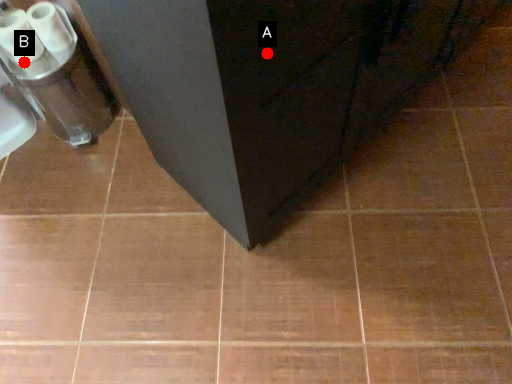
Question: Two points are circled on the image, labeled by A and B beside each circle. Which point is closer to the camera?

Choices:
 (A) A is closer
 (B) B is closer

Answer: (A)